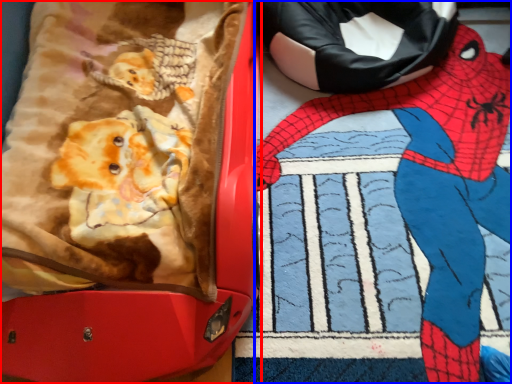
Question: Which point is further to the camera, suitcase (highlighted by a red box) or person (highlighted by a blue box)?

Choices:
 (A) suitcase
 (B) person

Answer: (B)